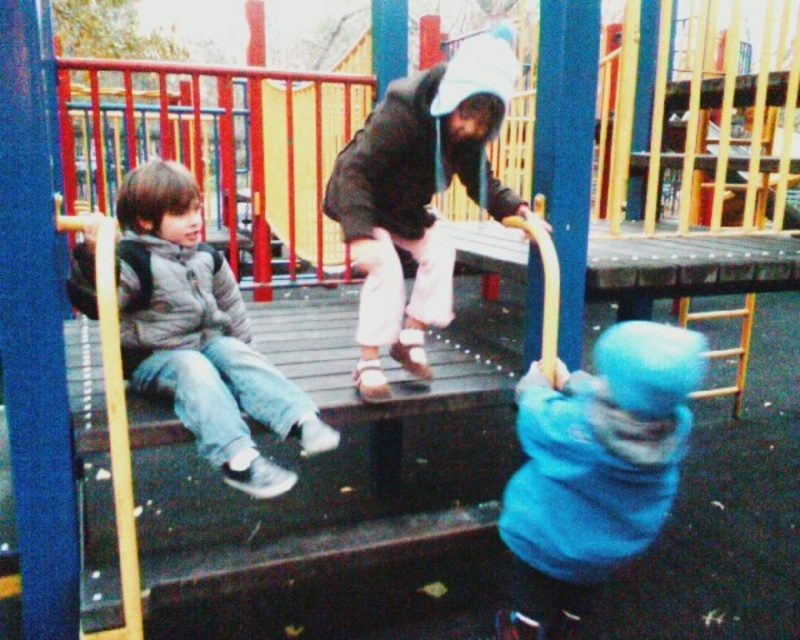
Can you confirm if blue fuzzy hat at lower right is thinner than gray fuzzy jacket at left?

Indeed, blue fuzzy hat at lower right has a lesser width compared to gray fuzzy jacket at left.

Is blue fuzzy hat at lower right closer to the viewer compared to gray fuzzy jacket at left?

Yes.

Is point (637, 410) farther from camera compared to point (154, 234)?

No, it is in front of (154, 234).

Where is `blue fuzzy hat at lower right`? blue fuzzy hat at lower right is located at coordinates (594, 468).